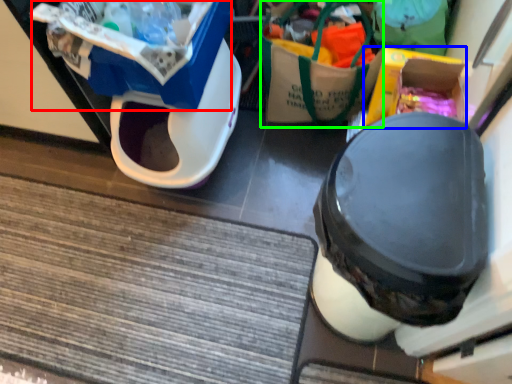
Question: Which object is the closest to the storage box (highlighted by a red box)? Choose among these: storage box (highlighted by a blue box) or garbage (highlighted by a green box).

Choices:
 (A) storage box
 (B) garbage

Answer: (B)